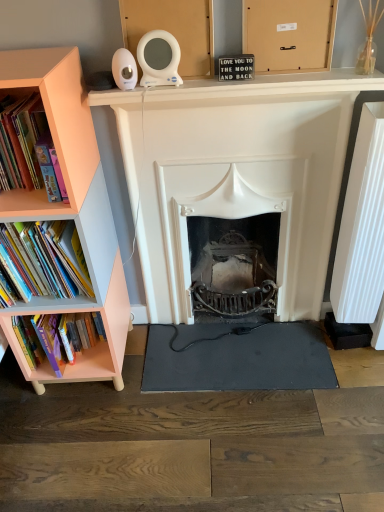
Identify the location of empty space that is ontop of black rubber yoga mat at center. (229, 348).